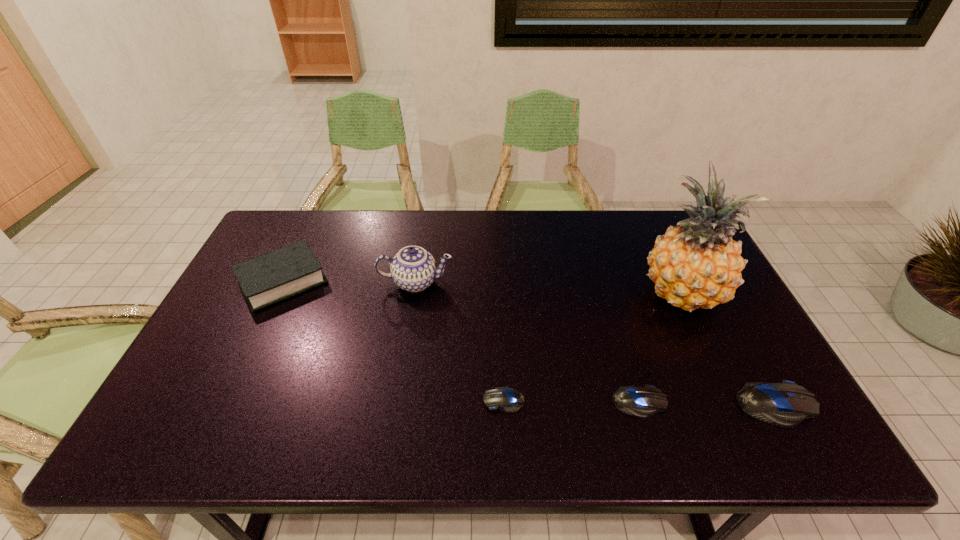
Please point a spot on the left to add another computer mouse. Please provide its 2D coordinates. Your answer should be formatted as a tuple, i.e. [(x, y)], where the tuple contains the x and y coordinates of a point satisfying the conditions above.

[(370, 398)]